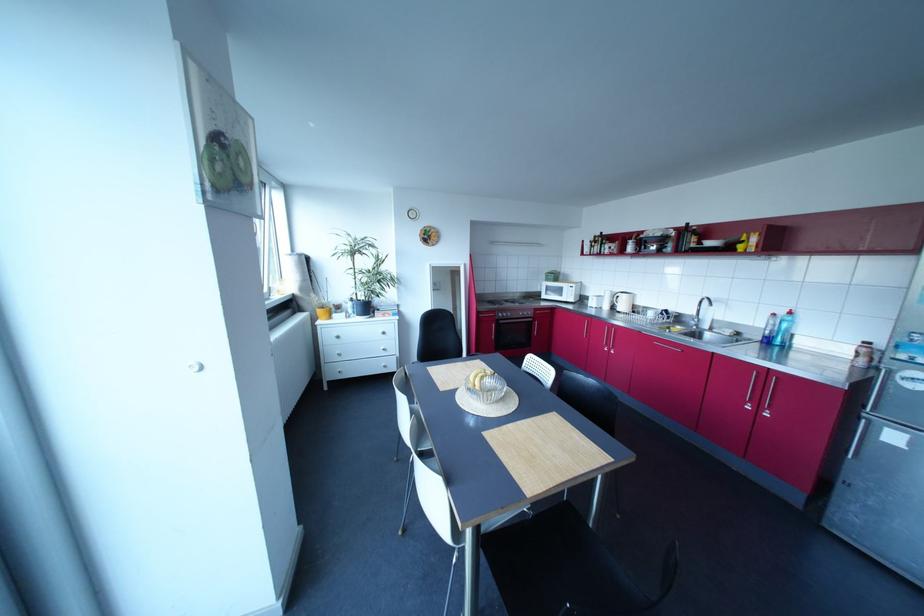
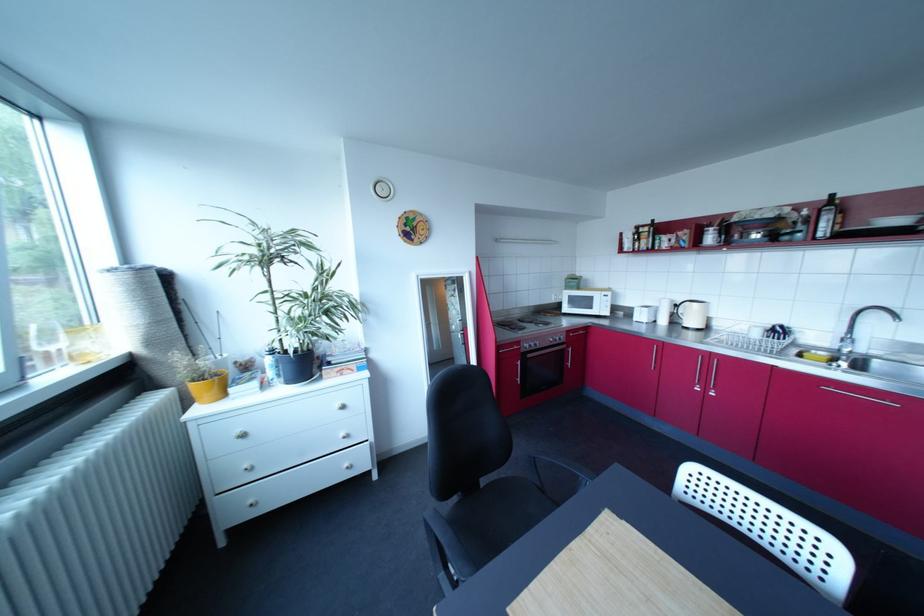
Question: In a continuous first-person perspective shot, in which direction is the camera moving?

Choices:
 (A) Left
 (B) Right
 (C) Forward
 (D) Backward

Answer: (C)